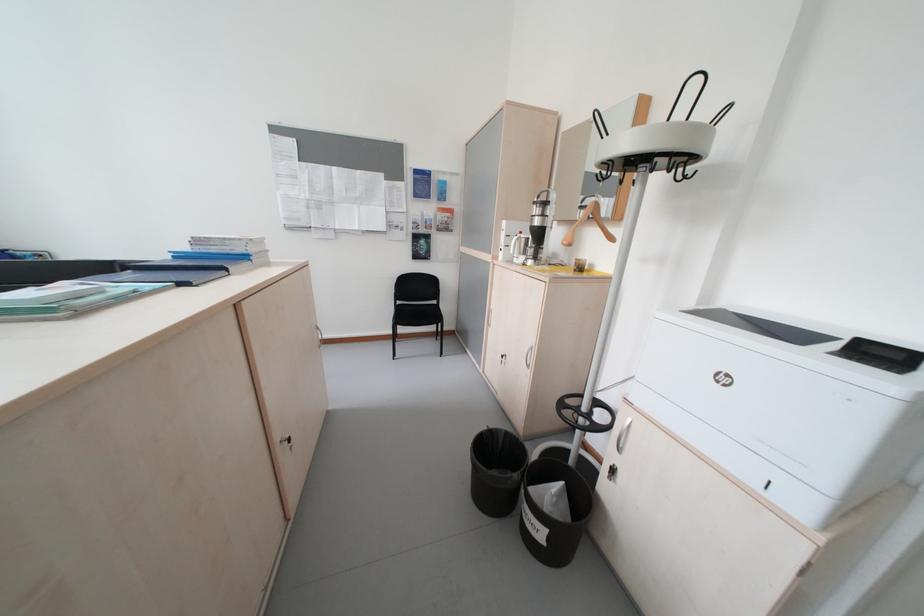
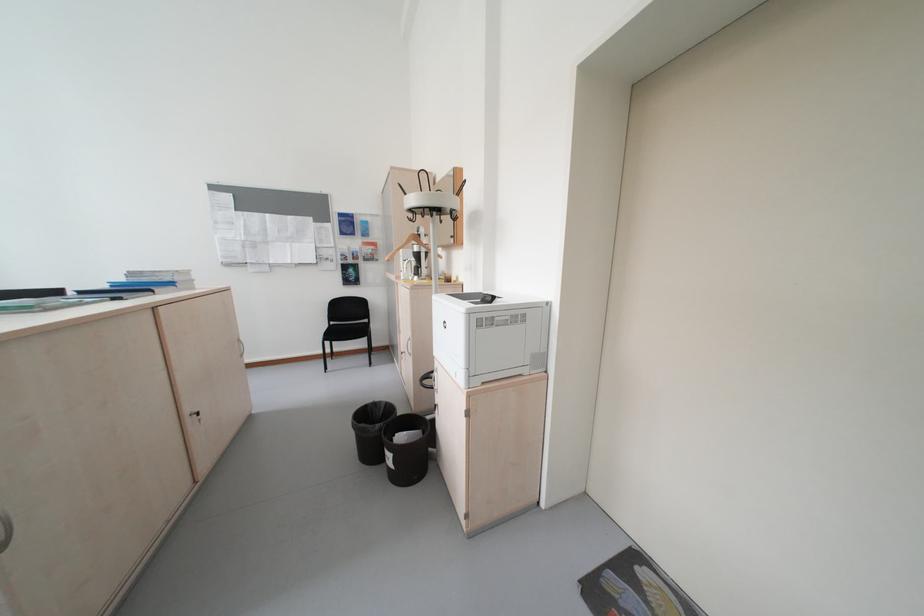
Locate, in the second image, the point that corresponds to (290,451) in the first image.

(200, 421)